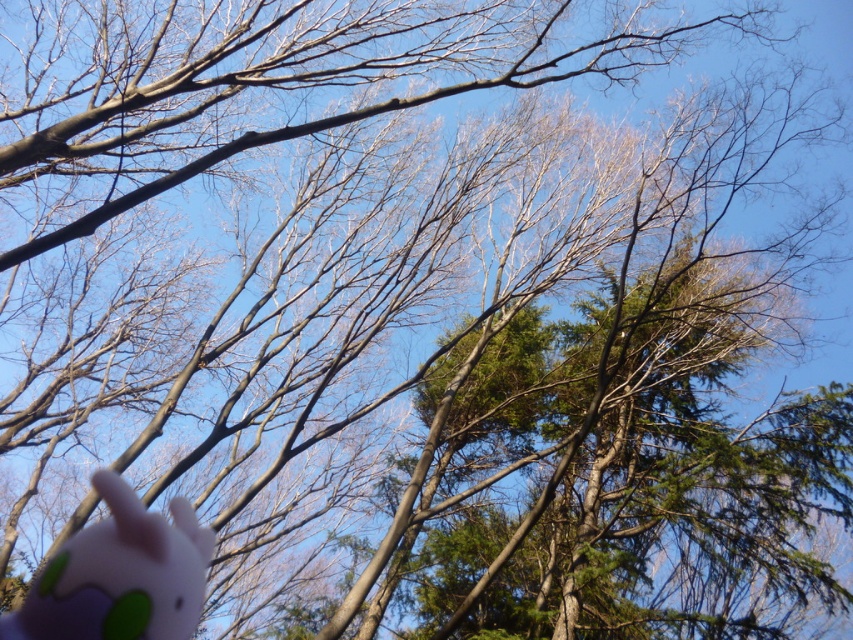
Who is higher up, brown matte branch at upper center or pink rubber toy at lower left?

Positioned higher is brown matte branch at upper center.

Based on the photo, who is taller, brown matte branch at upper center or pink rubber toy at lower left?

pink rubber toy at lower left is taller.

Is point (604, 33) positioned before point (148, 584)?

No, (604, 33) is further to viewer.

The height and width of the screenshot is (640, 853). Identify the location of brown matte branch at upper center. (271, 77).